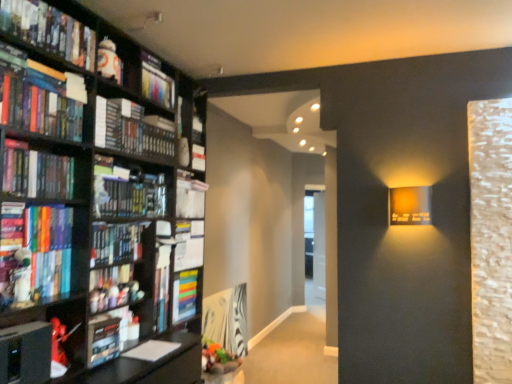
Question: From a real-world perspective, is hardcover book at left, the fourth book in the bottom-to-top sequence, on top of multicolored plastic book at center, the second book when ordered from bottom to top?

Choices:
 (A) yes
 (B) no

Answer: (A)

Question: Is hardcover book at left, the fourth book in the bottom-to-top sequence, thinner than multicolored plastic book at center, the eighth book when ordered from top to bottom?

Choices:
 (A) no
 (B) yes

Answer: (B)

Question: From a real-world perspective, is hardcover book at left, positioned as the sixth book in top-to-bottom order, beneath multicolored plastic book at center, the second book when ordered from bottom to top?

Choices:
 (A) no
 (B) yes

Answer: (A)

Question: Is hardcover book at left, the fourth book in the bottom-to-top sequence, to the left of multicolored plastic book at center, the second book when ordered from bottom to top, from the viewer's perspective?

Choices:
 (A) yes
 (B) no

Answer: (A)

Question: From the image's perspective, does hardcover book at left, the fourth book in the bottom-to-top sequence, appear lower than multicolored plastic book at center, the second book when ordered from bottom to top?

Choices:
 (A) yes
 (B) no

Answer: (B)

Question: From the image's perspective, is hardcover book at left, positioned as the sixth book in top-to-bottom order, above multicolored plastic book at center, the eighth book when ordered from top to bottom?

Choices:
 (A) no
 (B) yes

Answer: (B)

Question: Considering the relative sizes of matte plastic book at upper left, positioned as the 2th book in top-to-bottom order, and matte black book at left, the seventh book from the bottom, in the image provided, is matte plastic book at upper left, positioned as the 2th book in top-to-bottom order, wider than matte black book at left, the seventh book from the bottom,?

Choices:
 (A) yes
 (B) no

Answer: (A)

Question: From the image's perspective, does matte plastic book at upper left, the 8th book when ordered from bottom to top, appear lower than matte black book at left, the seventh book from the bottom?

Choices:
 (A) yes
 (B) no

Answer: (B)

Question: Is matte plastic book at upper left, positioned as the 2th book in top-to-bottom order, to the left of matte black book at left, the third book from the top, from the viewer's perspective?

Choices:
 (A) no
 (B) yes

Answer: (A)

Question: Is matte plastic book at upper left, positioned as the 2th book in top-to-bottom order, far from matte black book at left, the seventh book from the bottom?

Choices:
 (A) no
 (B) yes

Answer: (A)

Question: Does matte plastic book at upper left, positioned as the 2th book in top-to-bottom order, come in front of matte black book at left, the seventh book from the bottom?

Choices:
 (A) yes
 (B) no

Answer: (B)

Question: Is matte plastic book at upper left, positioned as the 2th book in top-to-bottom order, positioned beyond the bounds of matte black book at left, the third book from the top?

Choices:
 (A) no
 (B) yes

Answer: (B)

Question: Is hardcover book at left, arranged as the 7th book when viewed from the top, next to matte black book at left, the third book from the top, and touching it?

Choices:
 (A) yes
 (B) no

Answer: (B)